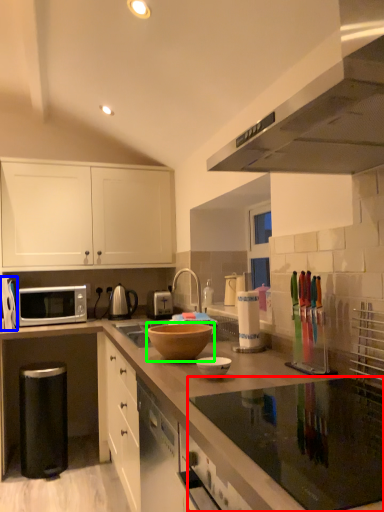
Question: Considering the real-world distances, which object is farthest from gas stove (highlighted by a red box)? appliance (highlighted by a blue box) or mixing bowl (highlighted by a green box)?

Choices:
 (A) appliance
 (B) mixing bowl

Answer: (A)